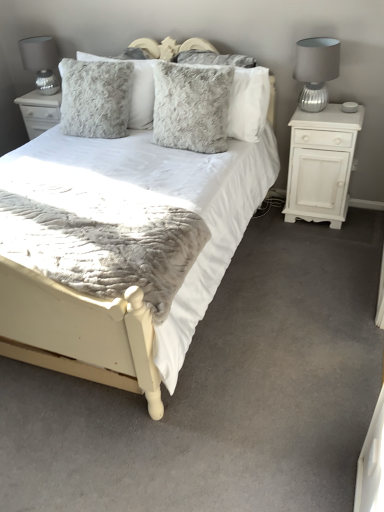
Question: Should I look upward or downward to see silver ribbed glass table lamp at right, which appears as the second table lamp when viewed from the back?

Choices:
 (A) up
 (B) down

Answer: (A)

Question: Is fuzzy gray pillow at upper center, arranged as the third pillow when viewed from the right, aimed at fuzzy gray pillow at center, the third pillow from the left?

Choices:
 (A) no
 (B) yes

Answer: (A)

Question: Is fuzzy gray pillow at upper center, which is counted as the first pillow, starting from the left, shorter than fuzzy gray pillow at center, the third pillow from the left?

Choices:
 (A) yes
 (B) no

Answer: (B)

Question: Is the surface of fuzzy gray pillow at upper center, arranged as the third pillow when viewed from the right, in direct contact with fuzzy gray pillow at center, the first pillow in the right-to-left sequence?

Choices:
 (A) no
 (B) yes

Answer: (A)

Question: Is fuzzy gray pillow at upper center, arranged as the third pillow when viewed from the right, wider than fuzzy gray pillow at center, the first pillow in the right-to-left sequence?

Choices:
 (A) yes
 (B) no

Answer: (A)

Question: Can we say fuzzy gray pillow at upper center, arranged as the third pillow when viewed from the right, lies outside fuzzy gray pillow at center, the third pillow from the left?

Choices:
 (A) yes
 (B) no

Answer: (A)

Question: Is fuzzy gray pillow at upper center, arranged as the third pillow when viewed from the right, taller than fuzzy gray pillow at center, the third pillow from the left?

Choices:
 (A) no
 (B) yes

Answer: (B)

Question: Is silver ribbed glass table lamp at right, which is the 2th table lamp in left-to-right order, smaller than fuzzy gray pillow at center, the first pillow in the right-to-left sequence?

Choices:
 (A) no
 (B) yes

Answer: (B)

Question: Is the surface of silver ribbed glass table lamp at right, which is the 2th table lamp in left-to-right order, in direct contact with fuzzy gray pillow at center, the first pillow in the right-to-left sequence?

Choices:
 (A) yes
 (B) no

Answer: (B)

Question: From the image's perspective, does silver ribbed glass table lamp at right, which is the 2th table lamp in left-to-right order, appear higher than fuzzy gray pillow at center, the third pillow from the left?

Choices:
 (A) yes
 (B) no

Answer: (A)

Question: Is silver ribbed glass table lamp at right, which is the 1th table lamp in right-to-left order, oriented away from fuzzy gray pillow at center, the third pillow from the left?

Choices:
 (A) yes
 (B) no

Answer: (B)

Question: From a real-world perspective, is silver ribbed glass table lamp at right, which appears as the second table lamp when viewed from the back, located beneath fuzzy gray pillow at center, the third pillow from the left?

Choices:
 (A) no
 (B) yes

Answer: (A)

Question: Is fuzzy gray pillow at center, the first pillow in the right-to-left sequence, located within silver ribbed glass table lamp at right, which appears as the second table lamp when viewed from the back?

Choices:
 (A) no
 (B) yes

Answer: (A)

Question: Is white matte cabinet at right shorter than fuzzy gray pillow at center, which ranks as the second pillow in left-to-right order?

Choices:
 (A) yes
 (B) no

Answer: (B)